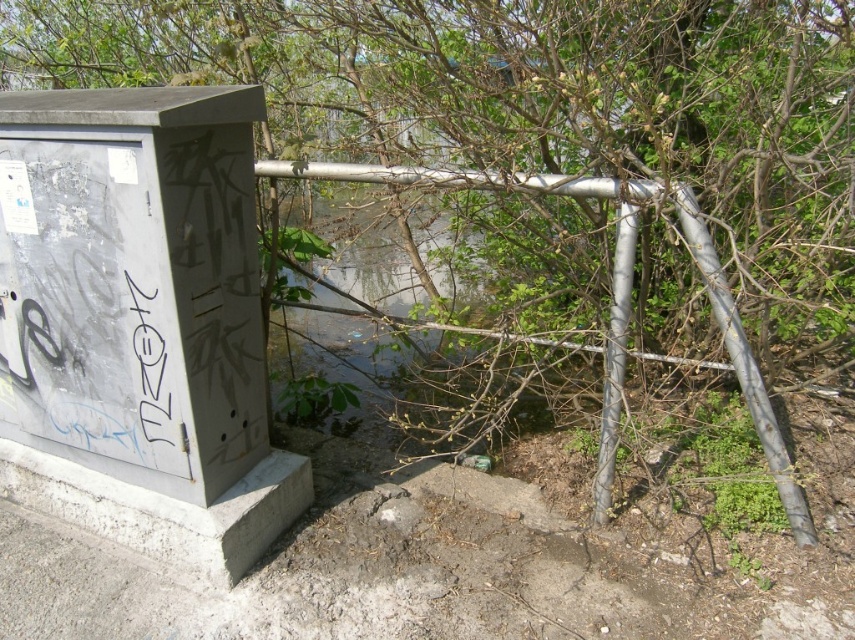
You are a maintenance worker needing to access the black graffiti at left. There is a metallic silver rail at center in the way. Can you reach the graffiti without moving the rail?

The metallic silver rail at center is above the black graffiti at left, so you can reach the graffiti without moving the rail since it is positioned below the rail.

You are a maintenance worker inspecting the utility box and pipes. You notice two points marked on your map at coordinates point (761,390) and point (718,308). Which point is closer to you when standing in front of the utility box?

Point (761,390) is closer to you because it is further to the viewer than point (718,308).